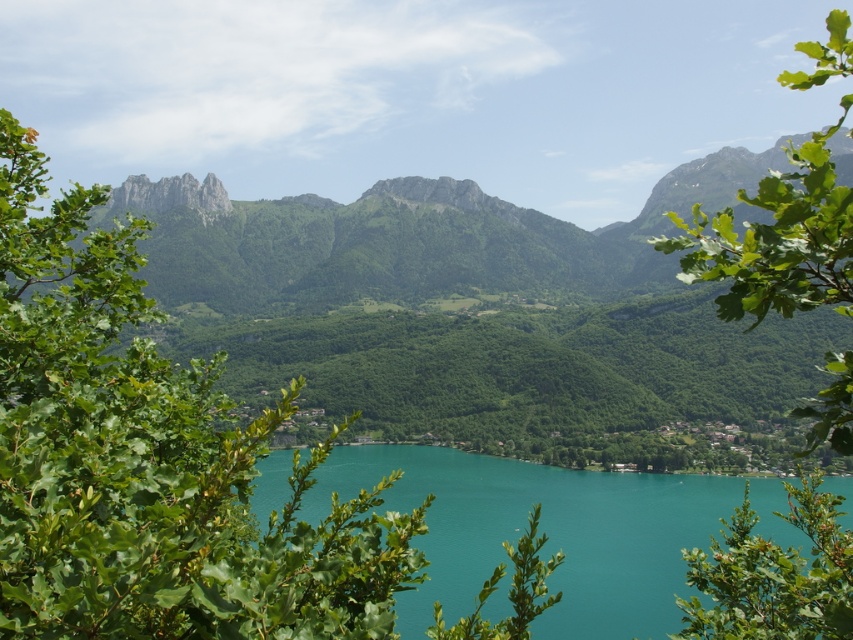
Who is more forward, (331, 468) or (741, 525)?

Point (741, 525) is more forward.

Between teal glossy water at center and green leafy tree at lower right, which one appears on the right side from the viewer's perspective?

From the viewer's perspective, green leafy tree at lower right appears more on the right side.

Find the location of `teal glossy water at center`. teal glossy water at center is located at coordinates (540, 531).

Is point (12, 429) behind point (717, 602)?

No.

Measure the distance between green leafy tree at left and camera.

green leafy tree at left is 79.73 feet away from camera.

Where is `green leafy tree at left`? Image resolution: width=853 pixels, height=640 pixels. green leafy tree at left is located at coordinates (151, 460).

Is teal glossy water at center shorter than green leafy tree at upper right?

Yes.

Between teal glossy water at center and green leafy tree at upper right, which one is positioned lower?

teal glossy water at center is lower down.

What do you see at coordinates (540, 531) in the screenshot? This screenshot has height=640, width=853. I see `teal glossy water at center` at bounding box center [540, 531].

Locate an element on the screen. teal glossy water at center is located at coordinates (540, 531).